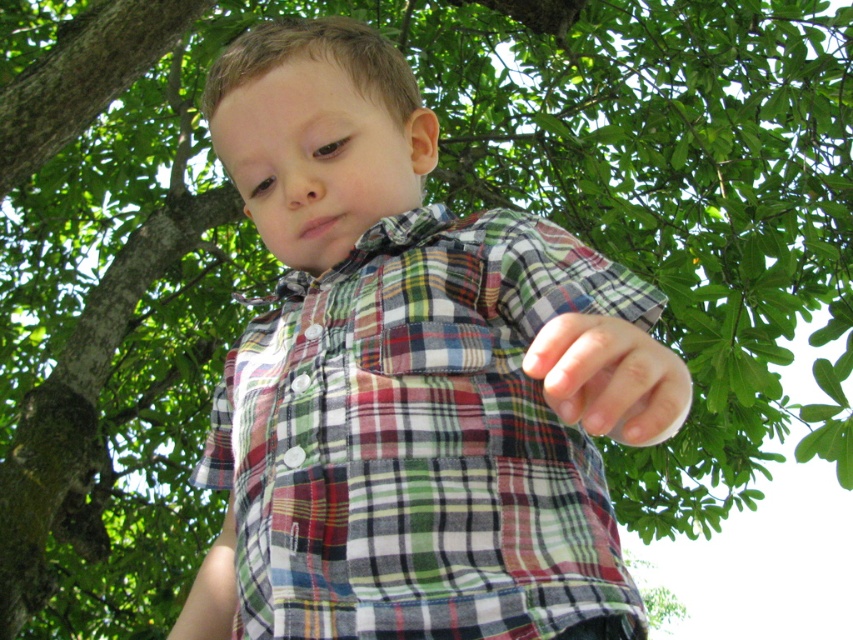
Question: Among these points, which one is nearest to the camera?

Choices:
 (A) (357, 76)
 (B) (648, 406)

Answer: (B)

Question: Among these points, which one is nearest to the camera?

Choices:
 (A) (314, 112)
 (B) (630, 346)

Answer: (B)

Question: Can you confirm if plaid cotton shirt at center is bigger than matte plaid shirt at center?

Choices:
 (A) no
 (B) yes

Answer: (B)

Question: Can you confirm if plaid cotton shirt at center is bigger than matte plaid shirt at center?

Choices:
 (A) yes
 (B) no

Answer: (A)

Question: Can you confirm if plaid cotton shirt at center is smaller than matte plaid shirt at center?

Choices:
 (A) no
 (B) yes

Answer: (A)

Question: Among these points, which one is nearest to the camera?

Choices:
 (A) click(618, 385)
 (B) click(10, 180)
 (C) click(239, 72)

Answer: (A)